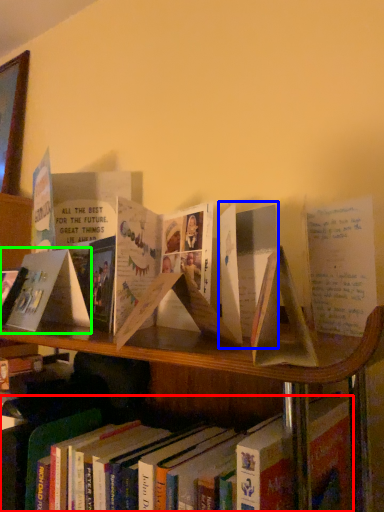
Question: Which is nearer to the book (highlighted by a red box)? paperback book (highlighted by a blue box) or paperback book (highlighted by a green box).

Choices:
 (A) paperback book
 (B) paperback book

Answer: (A)